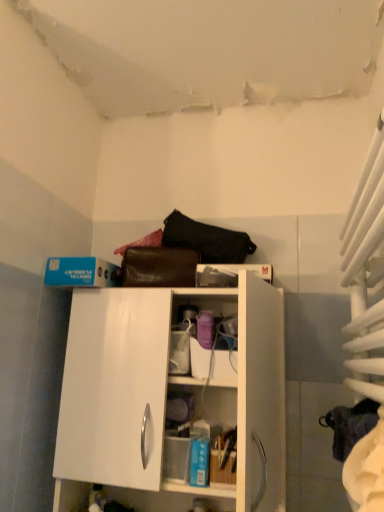
Question: Considering the positions of white fabric curtain at right and white glossy cabinet at center in the image, is white fabric curtain at right wider or thinner than white glossy cabinet at center?

Choices:
 (A) wide
 (B) thin

Answer: (B)

Question: Is white fabric curtain at right inside or outside of white glossy cabinet at center?

Choices:
 (A) inside
 (B) outside

Answer: (B)

Question: Which object is the farthest from the white glossy cabinet at center?

Choices:
 (A) black leather handbag at upper center
 (B) white fabric curtain at right

Answer: (B)

Question: Which is farther from the black leather handbag at upper center?

Choices:
 (A) white glossy cabinet at center
 (B) white fabric curtain at right

Answer: (B)